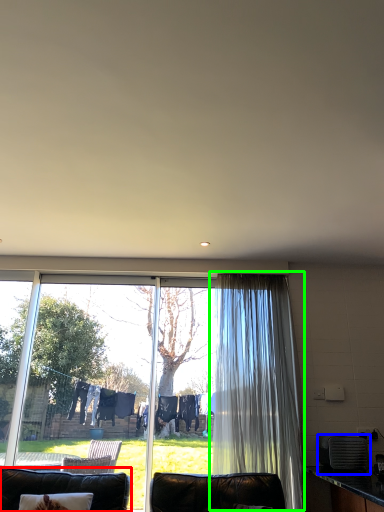
Question: Estimate the real-world distances between objects in this image. Which object is farther from furniture (highlighted by a red box), appliance (highlighted by a blue box) or curtain (highlighted by a green box)?

Choices:
 (A) appliance
 (B) curtain

Answer: (A)